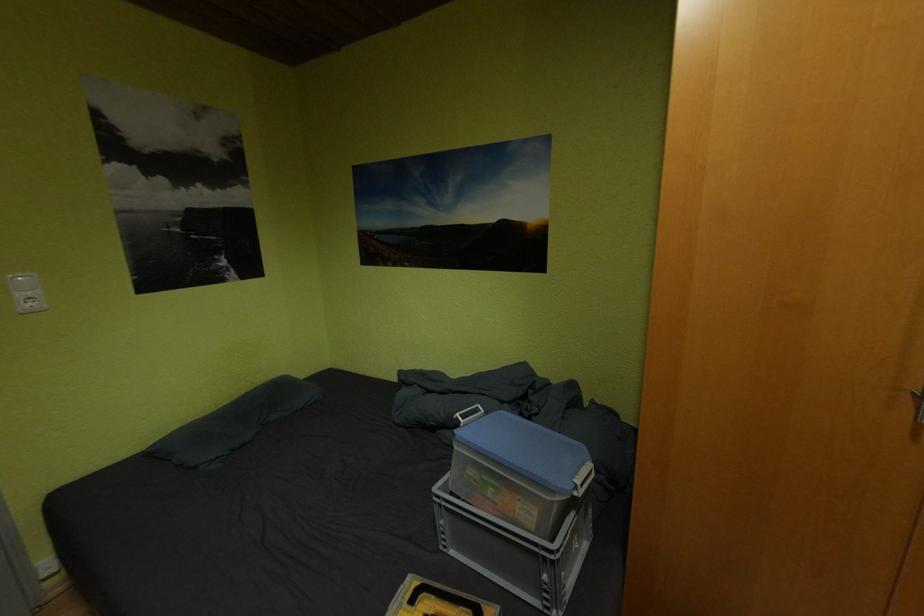
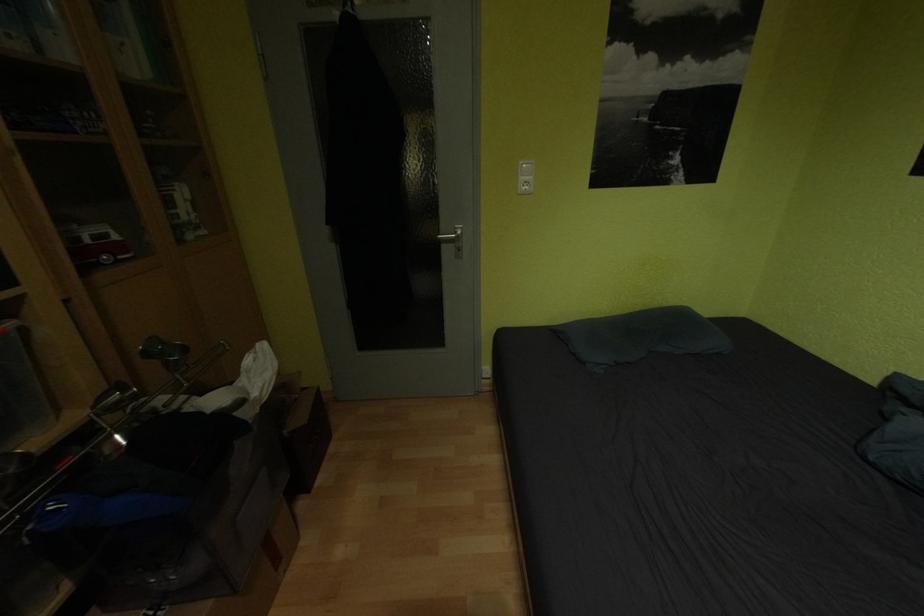
First-person continuous shooting, in which direction is the camera rotating?

The rotation direction of the camera is left-down.